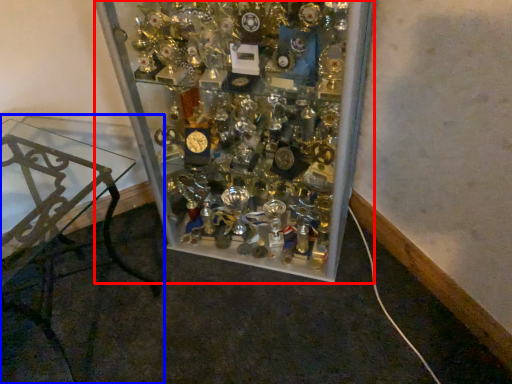
Question: Which object appears closest to the camera in this image, glass box (highlighted by a red box) or furniture (highlighted by a blue box)?

Choices:
 (A) glass box
 (B) furniture

Answer: (B)